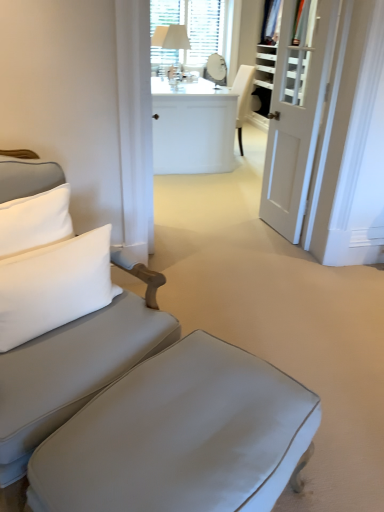
Where is `free point in front of white glossy door at right`? free point in front of white glossy door at right is located at coordinates (269, 242).